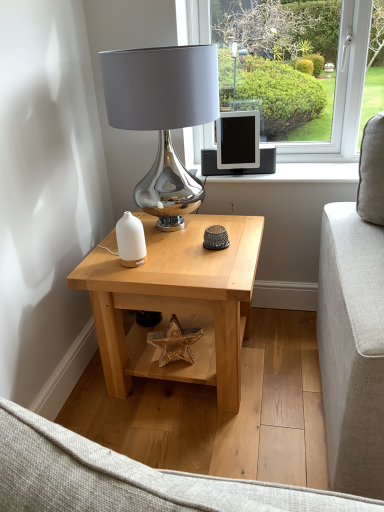
Question: From a real-world perspective, does natural wood table at center sit lower than shiny metallic lamp at center?

Choices:
 (A) no
 (B) yes

Answer: (B)

Question: Can you confirm if natural wood table at center is thinner than shiny metallic lamp at center?

Choices:
 (A) no
 (B) yes

Answer: (A)

Question: From the image's perspective, is natural wood table at center below shiny metallic lamp at center?

Choices:
 (A) no
 (B) yes

Answer: (B)

Question: Would you consider natural wood table at center to be distant from shiny metallic lamp at center?

Choices:
 (A) no
 (B) yes

Answer: (A)

Question: Is natural wood table at center to the right of shiny metallic lamp at center from the viewer's perspective?

Choices:
 (A) no
 (B) yes

Answer: (B)

Question: Considering the relative sizes of natural wood table at center and shiny metallic lamp at center in the image provided, is natural wood table at center bigger than shiny metallic lamp at center?

Choices:
 (A) no
 (B) yes

Answer: (B)

Question: Is matte black tablet at center outside white glossy candle holder at center?

Choices:
 (A) yes
 (B) no

Answer: (A)

Question: Considering the relative sizes of matte black tablet at center and white glossy candle holder at center in the image provided, is matte black tablet at center wider than white glossy candle holder at center?

Choices:
 (A) no
 (B) yes

Answer: (B)

Question: Is matte black tablet at center facing towards white glossy candle holder at center?

Choices:
 (A) no
 (B) yes

Answer: (A)

Question: Is matte black tablet at center looking in the opposite direction of white glossy candle holder at center?

Choices:
 (A) no
 (B) yes

Answer: (A)

Question: Is matte black tablet at center at the left side of white glossy candle holder at center?

Choices:
 (A) no
 (B) yes

Answer: (A)

Question: From a real-world perspective, is matte black tablet at center physically below white glossy candle holder at center?

Choices:
 (A) no
 (B) yes

Answer: (A)

Question: From a real-world perspective, is natural wood table at center under matte black tablet at center?

Choices:
 (A) no
 (B) yes

Answer: (B)